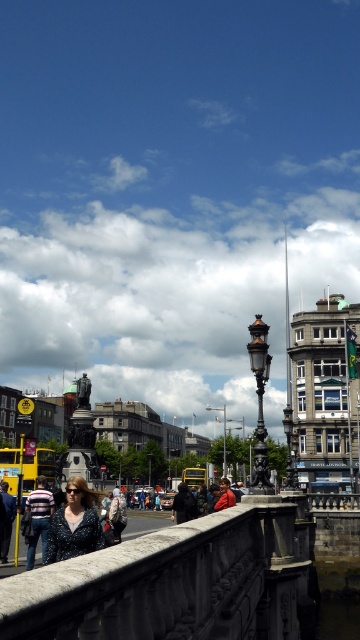
Is stone textured rail at center bigger than dark blue jacket at center?

No.

Between stone textured rail at center and dark blue jacket at center, which one has more height?

dark blue jacket at center

This screenshot has width=360, height=640. What do you see at coordinates (168, 584) in the screenshot?
I see `stone textured rail at center` at bounding box center [168, 584].

This screenshot has width=360, height=640. Identify the location of stone textured rail at center. pos(168,584).

Can you confirm if matte black blouse at lower left is positioned to the left of yellow rubber duck at lower center?

Indeed, matte black blouse at lower left is positioned on the left side of yellow rubber duck at lower center.

Does matte black blouse at lower left lie behind yellow rubber duck at lower center?

No, it is not.

Between point (90, 528) and point (199, 476), which one is positioned behind?

Point (199, 476)

Image resolution: width=360 pixels, height=640 pixels. Find the location of `matte black blouse at lower left`. matte black blouse at lower left is located at coordinates (74, 524).

Which of these two, striped sweater at center or yellow rubber duck at lower center, stands taller?

With more height is yellow rubber duck at lower center.

Is point (42, 509) positioned before point (196, 477)?

Yes, it is in front of point (196, 477).

This screenshot has width=360, height=640. What are the coordinates of `striped sweater at center` in the screenshot? It's located at (38, 516).